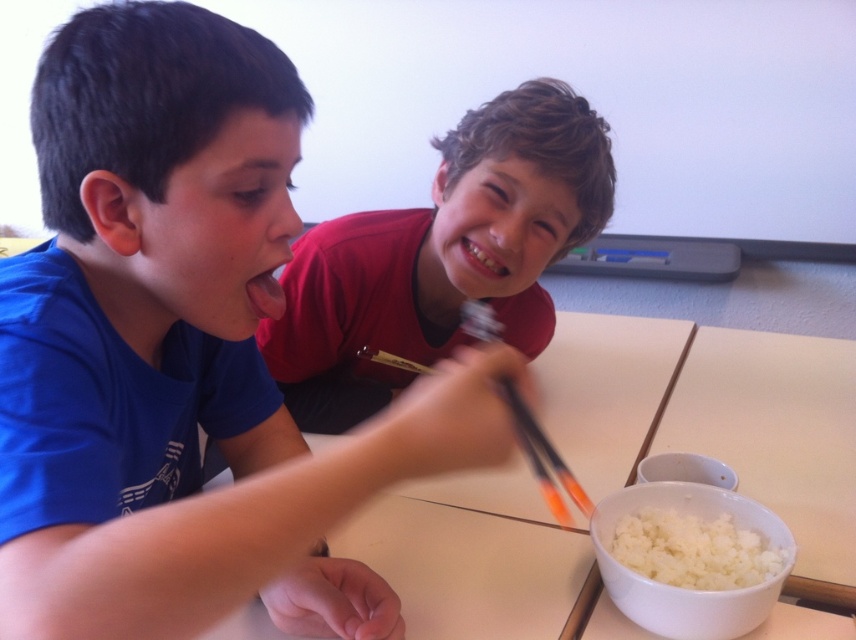
Is white matte table at center below white fluffy rice at lower right?

Actually, white matte table at center is above white fluffy rice at lower right.

Looking at this image, is white matte table at center behind white fluffy rice at lower right?

Yes.

Measure the distance between white matte table at center and camera.

The distance of white matte table at center from camera is 30.41 inches.

The image size is (856, 640). In order to click on white matte table at center in this screenshot , I will do `click(716, 420)`.

Is blue t-shirt at upper left to the right of white fluffy rice at lower right from the viewer's perspective?

Incorrect, blue t-shirt at upper left is not on the right side of white fluffy rice at lower right.

Where is `blue t-shirt at upper left`? blue t-shirt at upper left is located at coordinates click(x=182, y=353).

This screenshot has width=856, height=640. What are the coordinates of `blue t-shirt at upper left` in the screenshot? It's located at (182, 353).

This screenshot has height=640, width=856. Find the location of `blue t-shirt at upper left`. blue t-shirt at upper left is located at coordinates (182, 353).

Can you confirm if blue t-shirt at upper left is positioned to the right of white matte table at center?

In fact, blue t-shirt at upper left is to the left of white matte table at center.

Where is `blue t-shirt at upper left`? Image resolution: width=856 pixels, height=640 pixels. blue t-shirt at upper left is located at coordinates (182, 353).